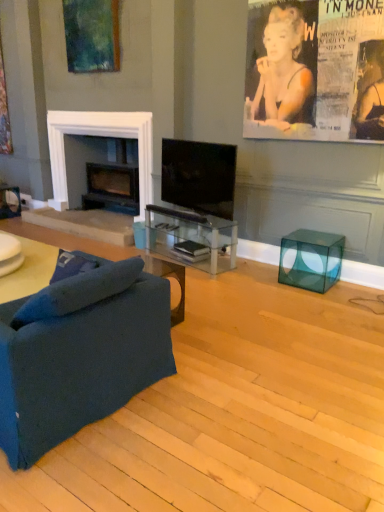
Question: Considering the relative sizes of transparent glass tv stand at center and matte black magazine at center, marked as the 2th magazine in a top-to-bottom arrangement, in the image provided, is transparent glass tv stand at center taller than matte black magazine at center, marked as the 2th magazine in a top-to-bottom arrangement,?

Choices:
 (A) yes
 (B) no

Answer: (A)

Question: From a real-world perspective, is transparent glass tv stand at center positioned under matte black magazine at center, the 1th magazine from the bottom, based on gravity?

Choices:
 (A) yes
 (B) no

Answer: (B)

Question: Considering the relative sizes of transparent glass tv stand at center and matte black magazine at center, the 1th magazine from the bottom, in the image provided, is transparent glass tv stand at center bigger than matte black magazine at center, the 1th magazine from the bottom,?

Choices:
 (A) no
 (B) yes

Answer: (B)

Question: Can you confirm if transparent glass tv stand at center is thinner than matte black magazine at center, marked as the 2th magazine in a top-to-bottom arrangement?

Choices:
 (A) no
 (B) yes

Answer: (A)

Question: Is transparent glass tv stand at center to the right of matte black magazine at center, the 1th magazine from the bottom, from the viewer's perspective?

Choices:
 (A) no
 (B) yes

Answer: (A)

Question: From the image's perspective, is transparent glass tv stand at center beneath matte black magazine at center, the 1th magazine from the bottom?

Choices:
 (A) no
 (B) yes

Answer: (A)

Question: Does black matte fireplace at left have a lesser height compared to transparent glass tv stand at center?

Choices:
 (A) no
 (B) yes

Answer: (A)

Question: Does black matte fireplace at left touch transparent glass tv stand at center?

Choices:
 (A) no
 (B) yes

Answer: (A)

Question: Is black matte fireplace at left looking in the opposite direction of transparent glass tv stand at center?

Choices:
 (A) no
 (B) yes

Answer: (A)

Question: Does black matte fireplace at left have a larger size compared to transparent glass tv stand at center?

Choices:
 (A) no
 (B) yes

Answer: (B)

Question: Can you confirm if black matte fireplace at left is positioned to the left of transparent glass tv stand at center?

Choices:
 (A) yes
 (B) no

Answer: (A)

Question: Is black matte fireplace at left further to the viewer compared to transparent glass tv stand at center?

Choices:
 (A) yes
 (B) no

Answer: (A)

Question: Can you confirm if matte black book at center, which ranks as the 2th magazine in bottom-to-top order, is positioned to the left of transparent glass cube at lower right?

Choices:
 (A) no
 (B) yes

Answer: (B)